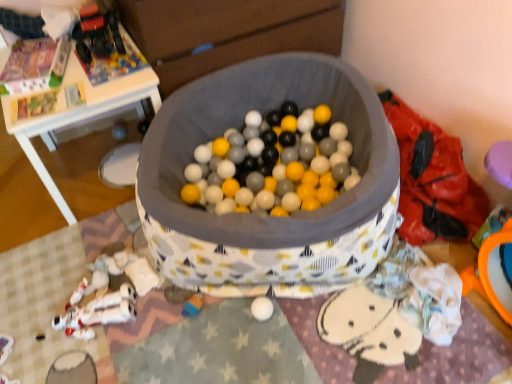
Find the location of a particular element. Image resolution: width=512 pixels, height=384 pixels. free location in front of white matte plastic toy at lower left, the 3th toy positioned from the bottom is located at coordinates (117, 335).